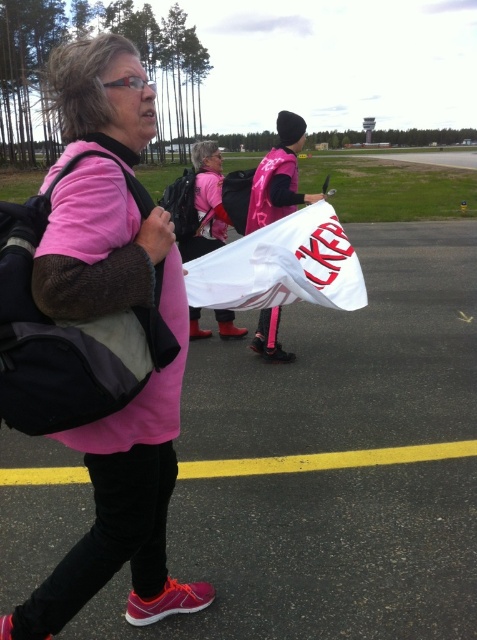
In the scene shown: Is white fabric at center above pink fabric shirt at center?

No, white fabric at center is not above pink fabric shirt at center.

Which is more to the right, white fabric at center or pink fabric shirt at center?

white fabric at center

Which is behind, point (434, 358) or point (133, 129)?

The point (434, 358) is more distant.

Where is `white fabric at center`? This screenshot has width=477, height=640. white fabric at center is located at coordinates (333, 464).

Which is behind, point (20, 285) or point (283, 163)?

Point (283, 163)

Can you confirm if black fabric backpack at left is smaller than matte pink vest at center?

Yes, black fabric backpack at left is smaller than matte pink vest at center.

Find the location of a particular element. This screenshot has height=640, width=477. black fabric backpack at left is located at coordinates (68, 333).

Does white fabric at center have a smaller size compared to black fabric backpack at left?

Indeed, white fabric at center has a smaller size compared to black fabric backpack at left.

Where is `white fabric at center`? white fabric at center is located at coordinates (333, 464).